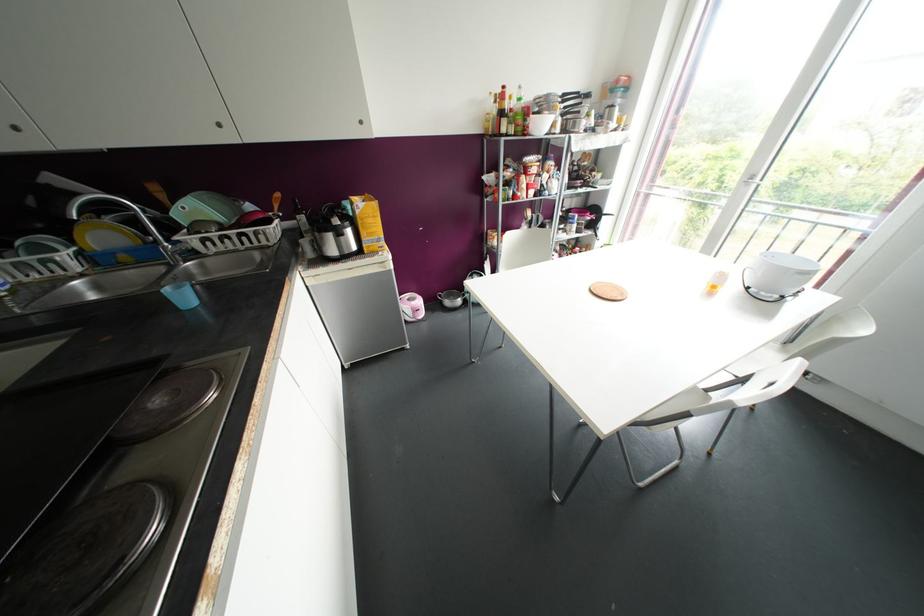
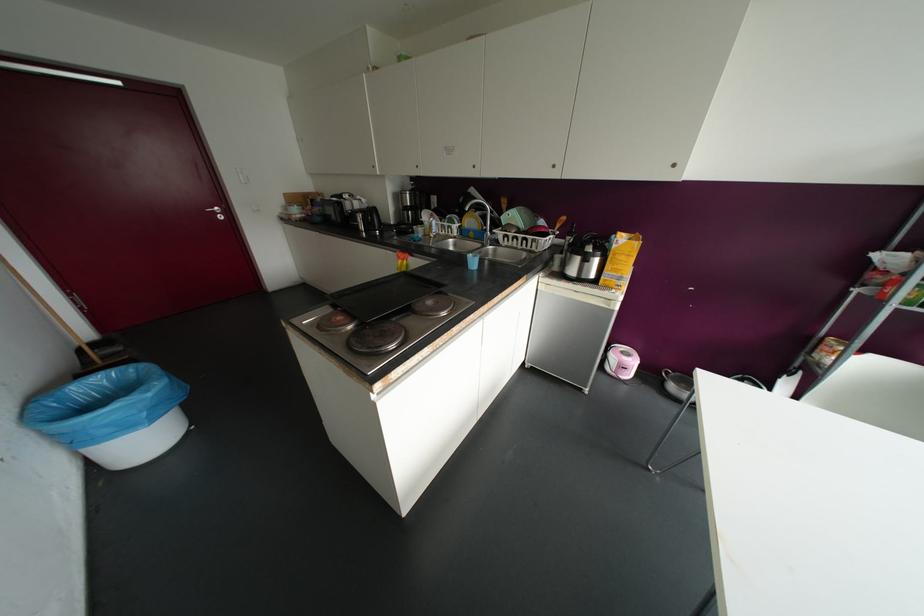
Find the pixel in the second image that matches point (219, 124) in the first image.

(553, 166)